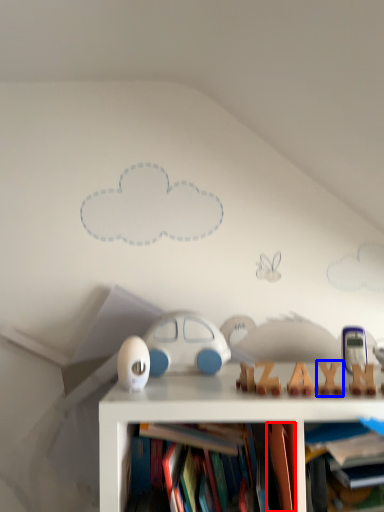
Question: Which object appears farthest to the camera in this image, book (highlighted by a red box) or toy (highlighted by a blue box)?

Choices:
 (A) book
 (B) toy

Answer: (B)